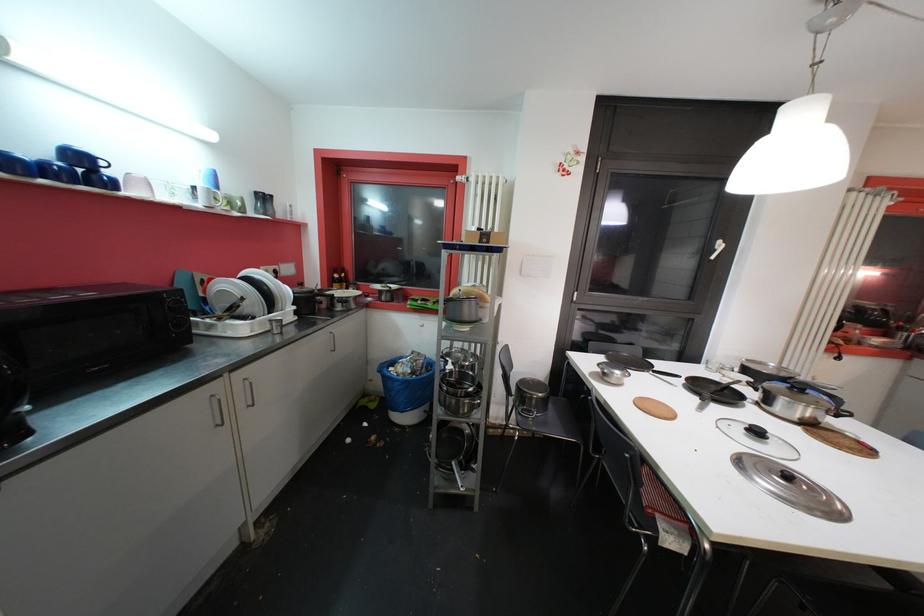
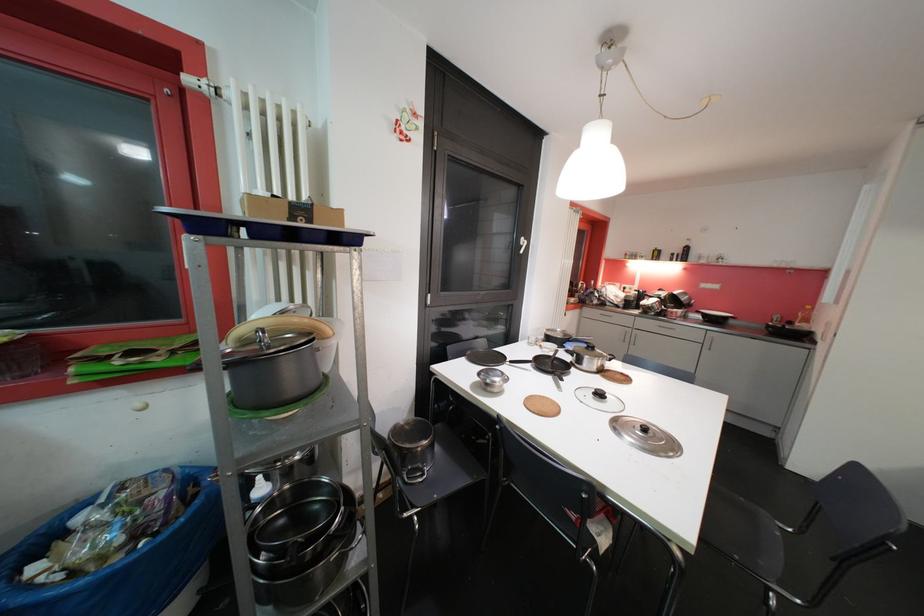
The point at [611,381] is marked in the first image. Where is the corresponding point in the second image?

(493, 392)